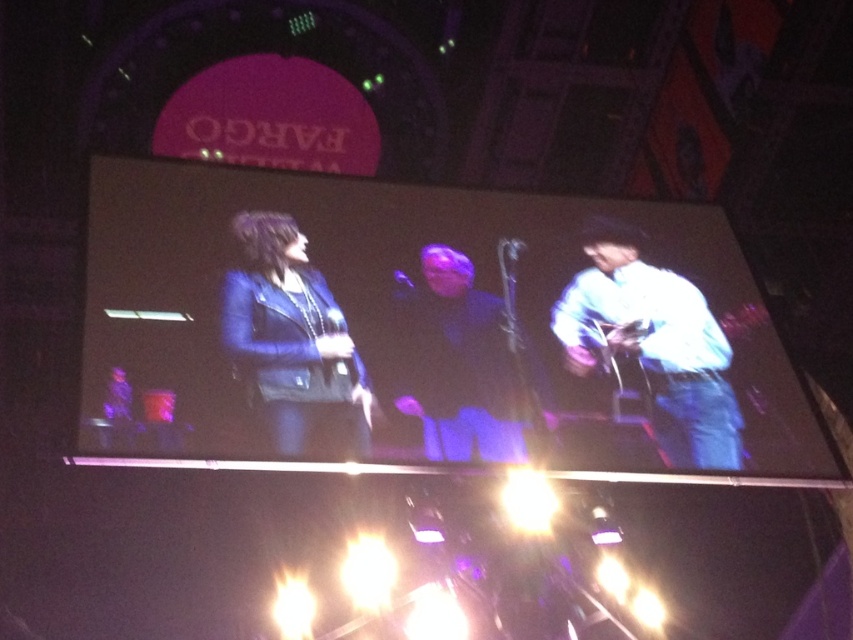
Question: Which point appears farthest from the camera in this image?

Choices:
 (A) (519, 440)
 (B) (312, 406)
 (C) (676, 406)

Answer: (C)

Question: Does white matte shirt at center come in front of dark blue leather jacket at center?

Choices:
 (A) no
 (B) yes

Answer: (A)

Question: Can you confirm if blue leather jacket at center is wider than dark blue leather jacket at center?

Choices:
 (A) no
 (B) yes

Answer: (B)

Question: Which of these objects is positioned farthest from the white matte shirt at center?

Choices:
 (A) dark blue leather jacket at center
 (B) blue leather jacket at center

Answer: (B)

Question: Can you confirm if blue leather jacket at center is positioned above dark blue leather jacket at center?

Choices:
 (A) no
 (B) yes

Answer: (B)

Question: Which object is closer to the camera taking this photo?

Choices:
 (A) blue leather jacket at center
 (B) white matte shirt at center
 (C) dark blue leather jacket at center

Answer: (A)